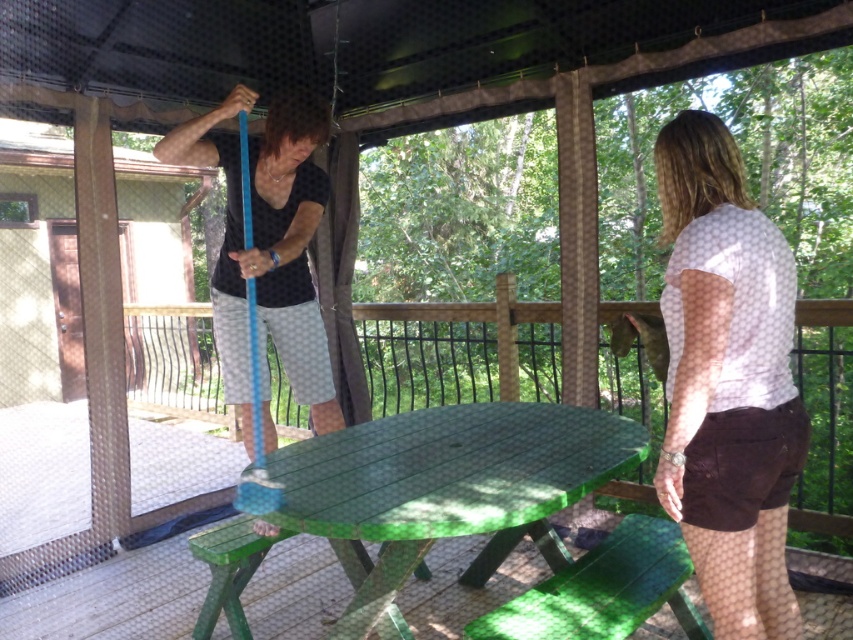
Question: Which of these objects is positioned closest to the green wood picnic table at center?

Choices:
 (A) green painted wood table at center
 (B) white dotted shirt at center

Answer: (A)

Question: Is the position of green wood picnic table at center less distant than that of green painted wood table at center?

Choices:
 (A) yes
 (B) no

Answer: (B)

Question: Can you confirm if green wood picnic table at center is bigger than green painted wood table at center?

Choices:
 (A) yes
 (B) no

Answer: (B)

Question: Does white dotted shirt at center come in front of green painted wood table at center?

Choices:
 (A) no
 (B) yes

Answer: (B)

Question: Which object appears farthest from the camera in this image?

Choices:
 (A) white dotted shirt at center
 (B) green wood picnic table at center

Answer: (B)

Question: Among these points, which one is nearest to the camera?

Choices:
 (A) (410, 518)
 (B) (712, 529)
 (C) (229, 456)

Answer: (B)